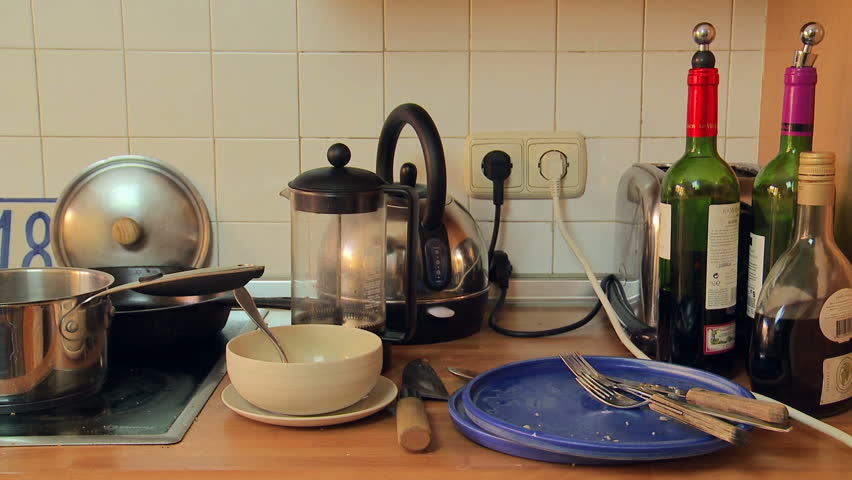
This screenshot has width=852, height=480. I want to click on outlet, so click(577, 173), click(515, 160).